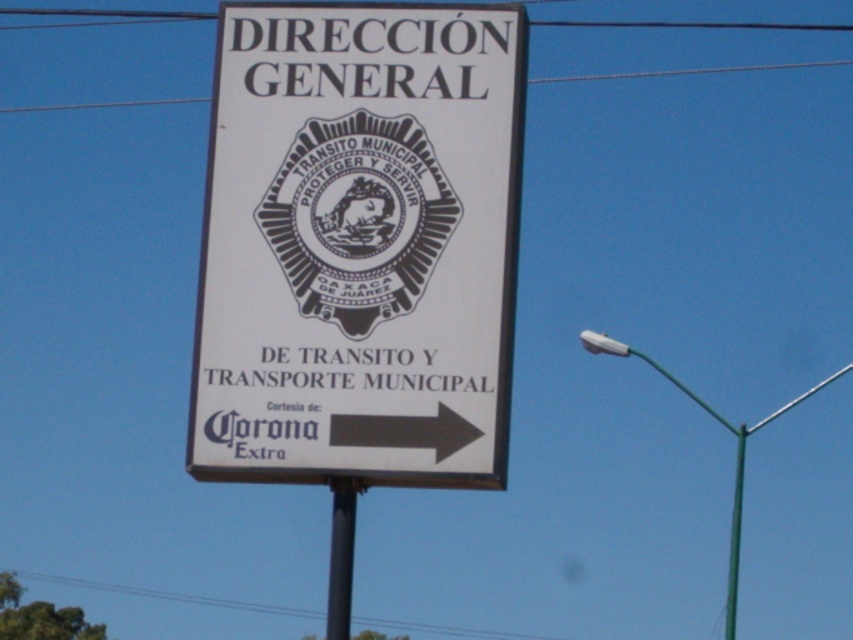
You are standing in front of the signboard mounted on the green metallic pole at right. You want to take a photo of the entire signboard without any part being cut off. Considering your camera has a maximum zoom range of 100 meters, will you be able to capture the entire signboard from your current position?

The distance between the green metallic pole at right and the camera is 134.63 meters, which exceeds the camera maximum zoom range of 100 meters. Therefore, you won not be able to capture the entire signboard without any part being cut off.

Consider the image. You are a delivery person trying to read the white paper sign at center attached to the green metallic pole at right. Can you see the entire text on the sign without moving closer? Explain why based on their sizes.

The white paper sign at center has a lesser height compared to green metallic pole at right, so it might be difficult to read the entire text on the sign from a distance because the sign is smaller in height than the pole, potentially making it harder to see all the details clearly without moving closer.